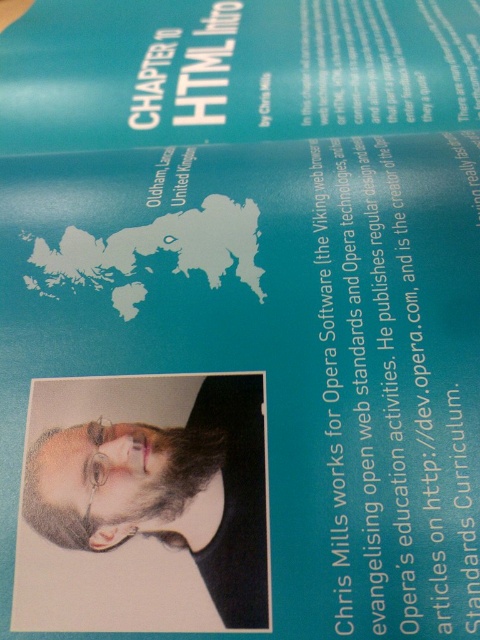
Is teal matte paper at upper center positioned before beige paper portrait at center?

No.

Which of these two, teal matte paper at upper center or beige paper portrait at center, stands taller?

teal matte paper at upper center

This screenshot has height=640, width=480. Identify the location of teal matte paper at upper center. (232, 70).